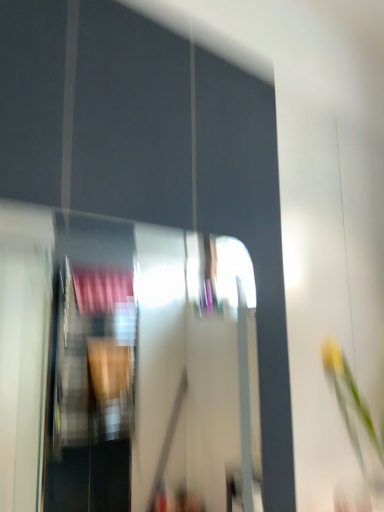
Where is `yellow matte flower at right`? yellow matte flower at right is located at coordinates (350, 398).

From the picture: What is the approximate width of yellow matte flower at right?

yellow matte flower at right is 6.74 inches in width.

Image resolution: width=384 pixels, height=512 pixels. What do you see at coordinates (350, 398) in the screenshot?
I see `yellow matte flower at right` at bounding box center [350, 398].

Measure the distance between point (347, 420) and camera.

Point (347, 420) is 1.23 meters away from camera.

Identify the location of yellow matte flower at right. This screenshot has width=384, height=512. (350, 398).